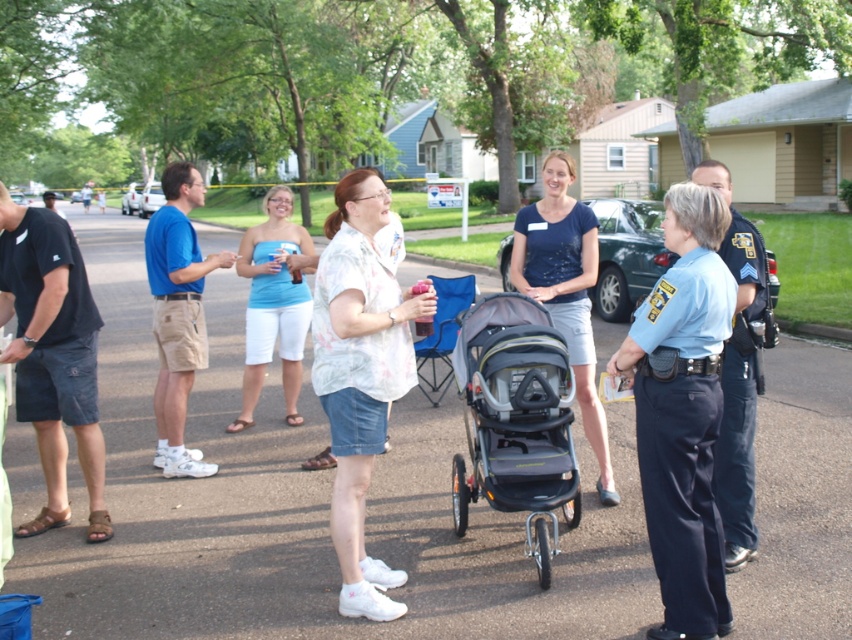
You are a photographer trying to capture a candid shot of the blue uniform pants at right without including the gray fabric stroller at center in the background. Is this possible given their current positions?

The blue uniform pants at right is positioned over gray fabric stroller at center, meaning the stroller is directly behind the pants. This would make it difficult to capture the pants without the stroller in the background unless you move to a different angle or position.